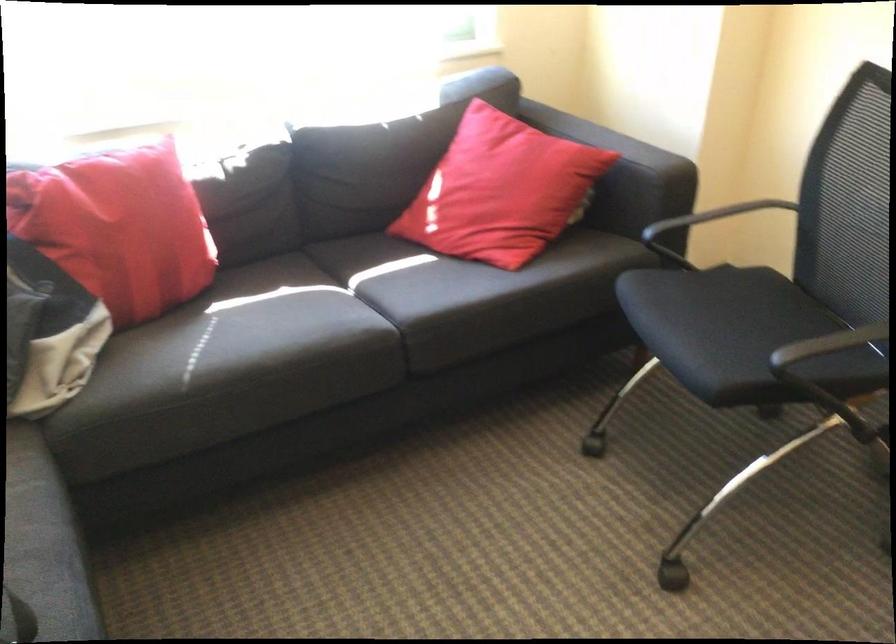
Describe the element at coordinates (280, 346) in the screenshot. The width and height of the screenshot is (896, 644). I see `the sofa sitting surface` at that location.